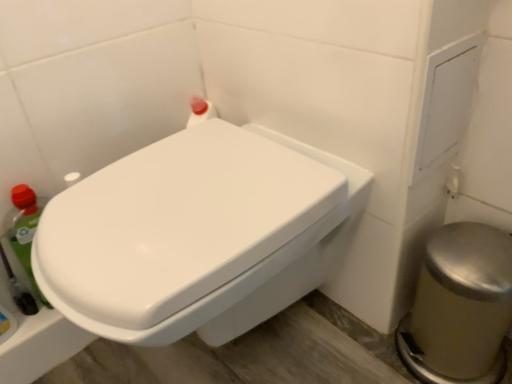
In order to face white glossy toilet at center, should I rotate leftwards or rightwards?

It's best to rotate left around 6.714 degrees.

The width and height of the screenshot is (512, 384). What do you see at coordinates (196, 233) in the screenshot?
I see `white glossy toilet at center` at bounding box center [196, 233].

This screenshot has width=512, height=384. I want to click on white glossy toilet at center, so click(196, 233).

Locate an element on the screen. Image resolution: width=512 pixels, height=384 pixels. white glossy toilet at center is located at coordinates (196, 233).